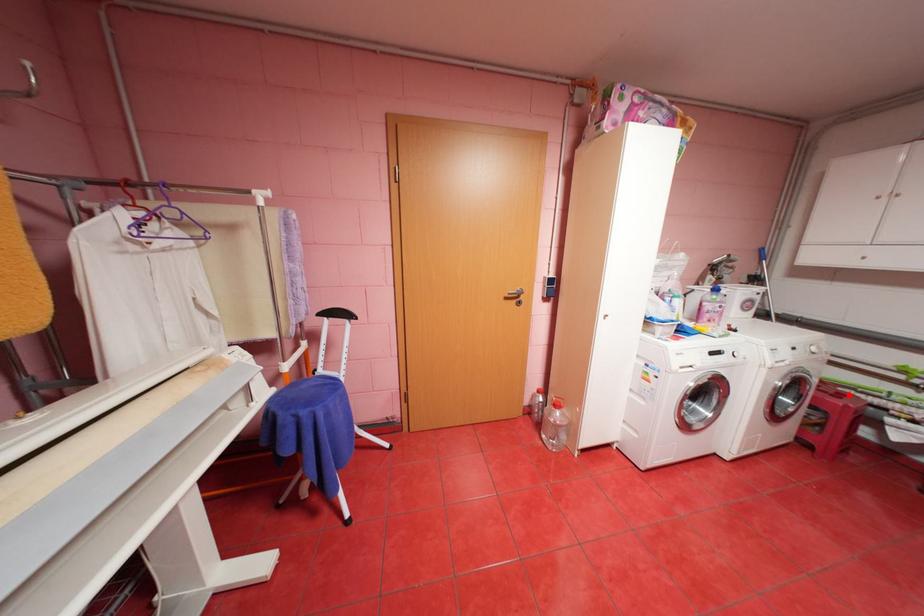
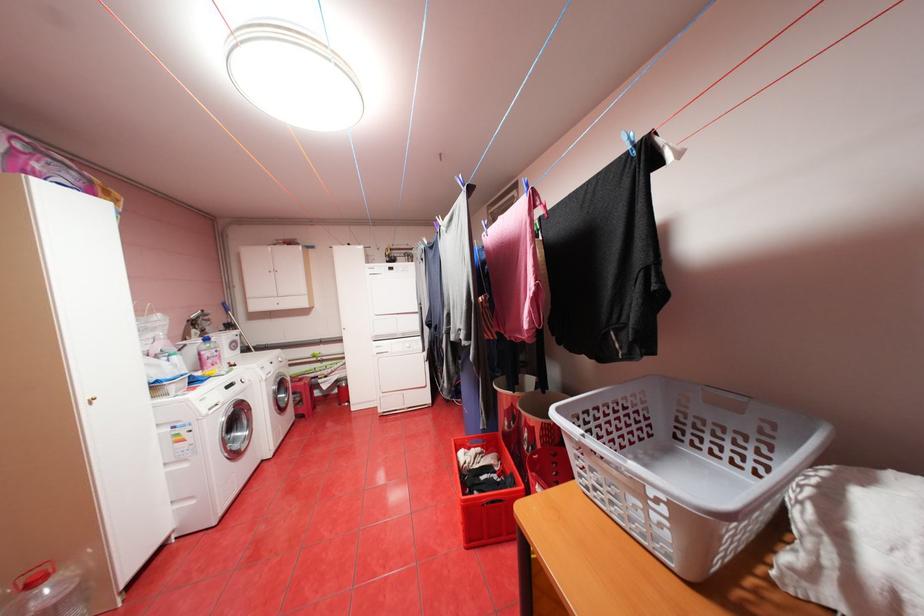
Locate, in the second image, the point that corresponds to the highlighted location in the first image.

(310, 379)